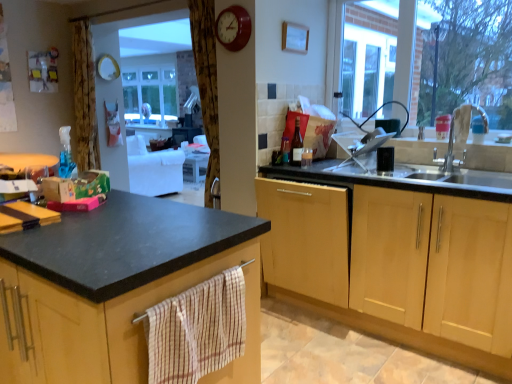
Question: Is matte black countertop at left, the 1th cabinetry in the left-to-right sequence, touching brown textured curtain at upper center?

Choices:
 (A) yes
 (B) no

Answer: (B)

Question: From the image's perspective, is matte black countertop at left, the 2th cabinetry viewed from the right, under brown textured curtain at upper center?

Choices:
 (A) no
 (B) yes

Answer: (B)

Question: Is matte black countertop at left, the 1th cabinetry in the left-to-right sequence, oriented away from brown textured curtain at upper center?

Choices:
 (A) yes
 (B) no

Answer: (B)

Question: Is matte black countertop at left, the 2th cabinetry viewed from the right, not within brown textured curtain at upper center?

Choices:
 (A) yes
 (B) no

Answer: (A)

Question: Does matte black countertop at left, the 2th cabinetry viewed from the right, have a lesser height compared to brown textured curtain at upper center?

Choices:
 (A) yes
 (B) no

Answer: (A)

Question: Can you confirm if matte black countertop at left, the 2th cabinetry viewed from the right, is taller than brown textured curtain at upper center?

Choices:
 (A) yes
 (B) no

Answer: (B)

Question: Can we say matte black countertop at left, the 2th cabinetry viewed from the right, lies outside metallic sink at right?

Choices:
 (A) yes
 (B) no

Answer: (A)

Question: Does matte black countertop at left, the 1th cabinetry in the left-to-right sequence, come in front of metallic sink at right?

Choices:
 (A) yes
 (B) no

Answer: (A)

Question: Can you confirm if matte black countertop at left, the 2th cabinetry viewed from the right, is positioned to the left of metallic sink at right?

Choices:
 (A) no
 (B) yes

Answer: (B)

Question: From a real-world perspective, does matte black countertop at left, the 2th cabinetry viewed from the right, sit lower than metallic sink at right?

Choices:
 (A) no
 (B) yes

Answer: (B)

Question: Considering the relative sizes of matte black countertop at left, the 1th cabinetry in the left-to-right sequence, and metallic sink at right in the image provided, is matte black countertop at left, the 1th cabinetry in the left-to-right sequence, smaller than metallic sink at right?

Choices:
 (A) yes
 (B) no

Answer: (B)

Question: Does metallic sink at right have a smaller size compared to matte black countertop at left, the 1th cabinetry in the left-to-right sequence?

Choices:
 (A) no
 (B) yes

Answer: (B)